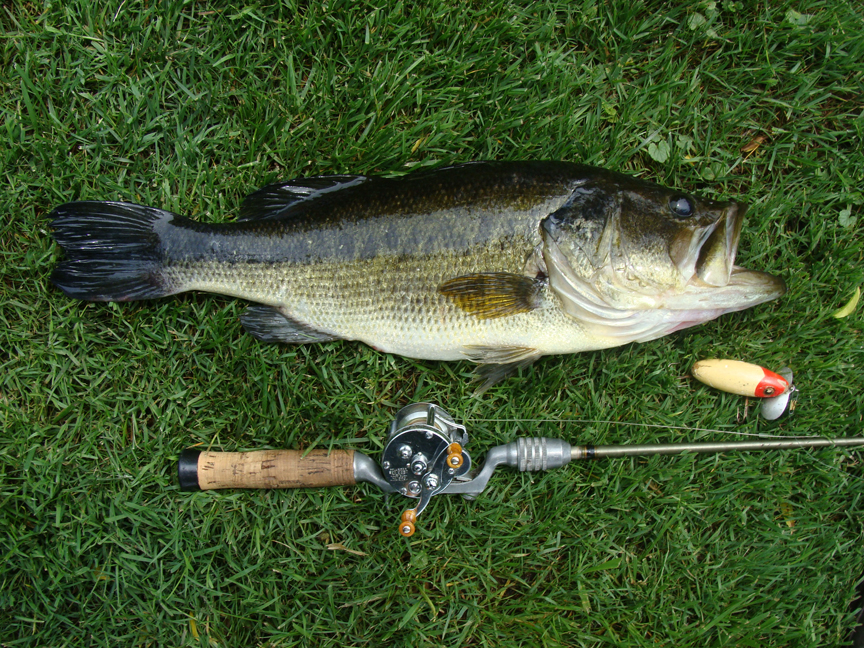
You are a GUI agent. You are given a task and a screenshot of the screen. Output one action in this format:
    pyautogui.click(x=<x>, y=<y>)
    Task: Click on the knob
    
    Given the screenshot: What is the action you would take?
    pyautogui.click(x=410, y=521)